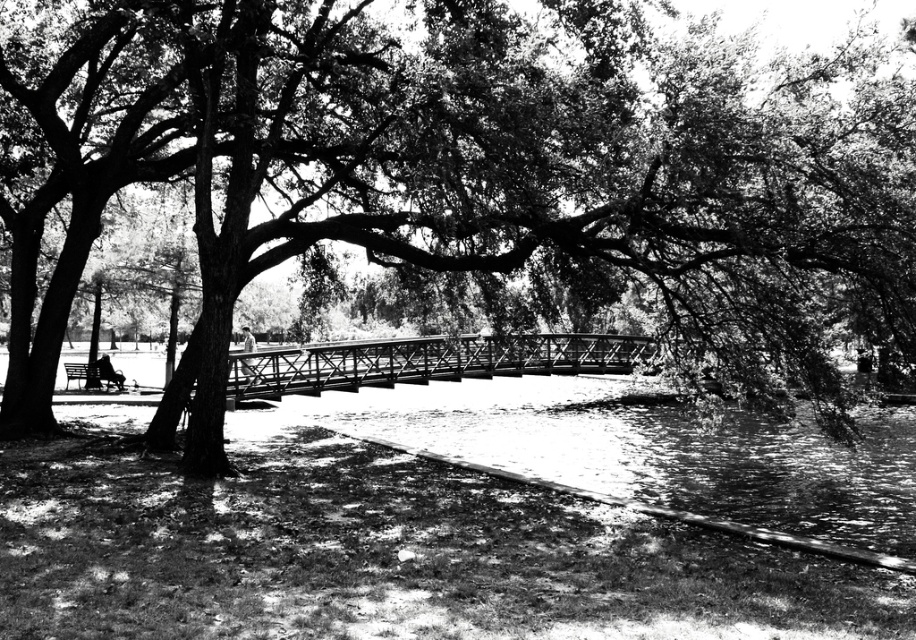
Which is more to the right, metallic bridge at center or wooden bench at lower left?

Positioned to the right is metallic bridge at center.

Between point (467, 369) and point (68, 369), which one is positioned behind?

The point (68, 369) is more distant.

Locate an element on the screen. This screenshot has width=916, height=640. metallic bridge at center is located at coordinates (431, 362).

Is smooth bark tree at center thinner than metallic bridge at center?

Incorrect, smooth bark tree at center's width is not less than metallic bridge at center's.

Is point (871, 112) less distant than point (611, 348)?

Yes, it is.

Identify the location of smooth bark tree at center. This screenshot has height=640, width=916. (449, 163).

Which is more to the left, smooth bark tree at center or wooden bench at lower left?

From the viewer's perspective, wooden bench at lower left appears more on the left side.

Describe the element at coordinates (449, 163) in the screenshot. I see `smooth bark tree at center` at that location.

Does point (712, 113) come in front of point (72, 372)?

That is True.

The height and width of the screenshot is (640, 916). Find the location of `smooth bark tree at center`. smooth bark tree at center is located at coordinates (449, 163).